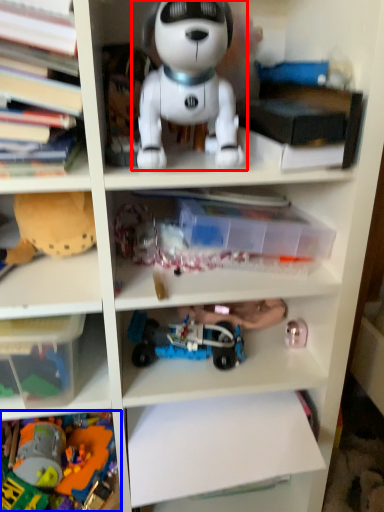
Question: Among these objects, which one is nearest to the camera, toy (highlighted by a red box) or toy (highlighted by a blue box)?

Choices:
 (A) toy
 (B) toy

Answer: (A)